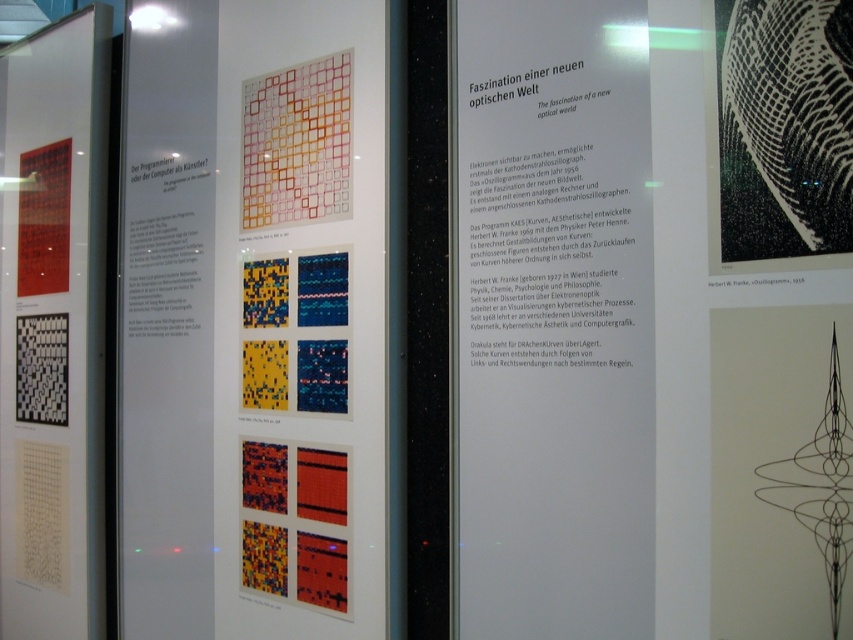
You are an art student analyzing the display panel. You notice the white paper at center and the black line drawing at upper right. Which object is taller?

The white paper at center is much taller than the black line drawing at upper right.

You are an art student who wants to compare the sizes of two artworks in the exhibition. You see the matte black poster at left and the black line drawing at upper right. Which artwork has a greater width?

The matte black poster at left has a greater width than the black line drawing at upper right.

From the picture: You are standing in front of the exhibition display panel about the theme Faszination einer neuen optischen Welt. You want to take a photo of the point at coordinates (614, 1) on the panel. If your camera has a focal length of 50mm and you are 1.29 meters away from the point, what is the approximate magnification factor of the image captured compared to the actual size?

The magnification factor can be calculated using the formula magnification equals focal length divided by distance. Here, the focal length is 50mm and the distance is 1.29 meters, which is 1290mm. So magnification equals 50 divided by 1290, approximately 0.039. This means the image will be about 3.9 percent of the actual size.